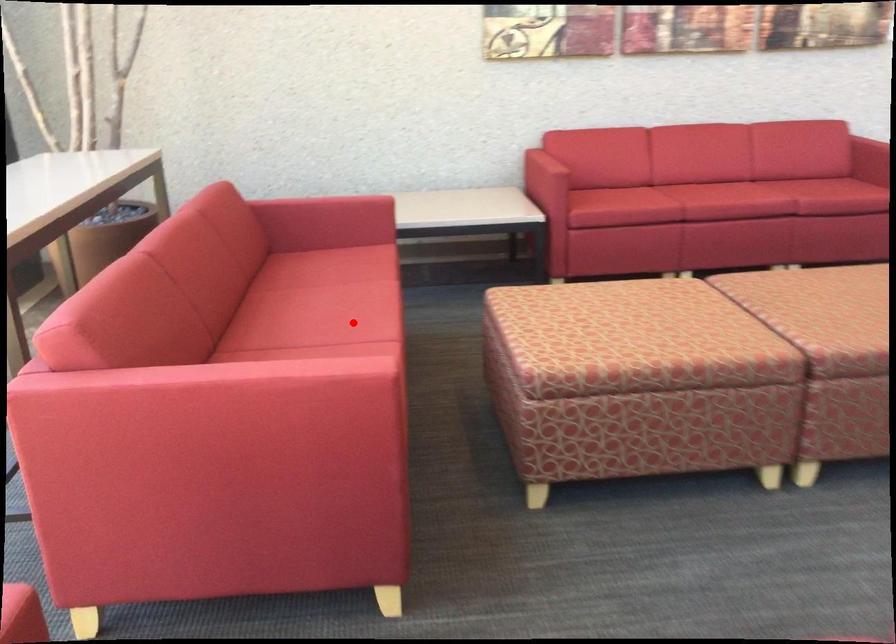
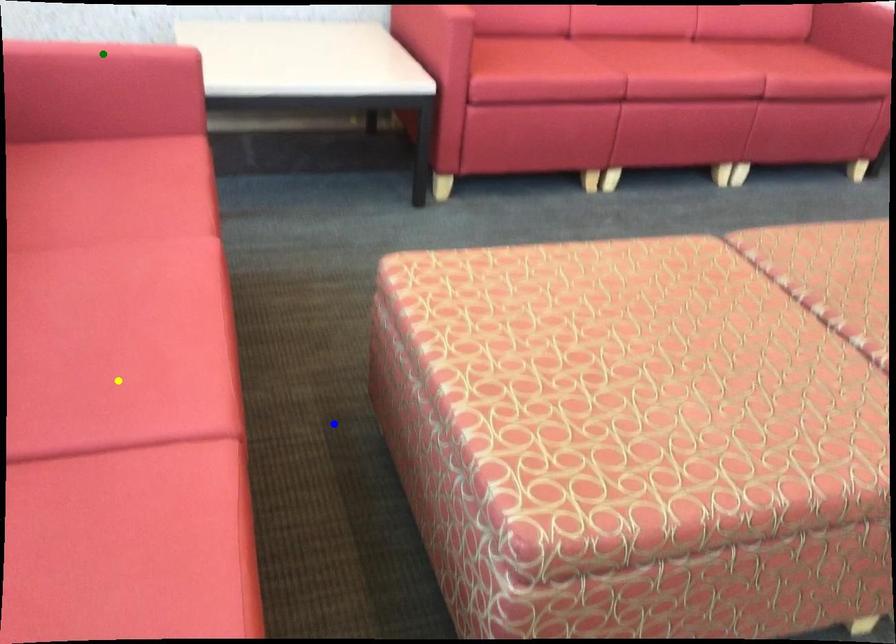
Question: I am providing you with two images of the same scene from different viewpoints. A red point is marked on the first image. You are given multiple points on the second image. Which point in image 2 is actually the same real-world point as the red point in image 1?

Choices:
 (A) yellow point
 (B) blue point
 (C) green point

Answer: (A)